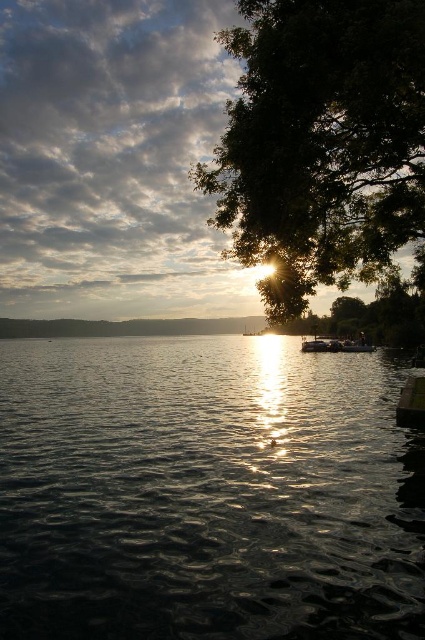
You are an observer standing at the lakeside. You see the glistening dark water at center and the green leafy tree at upper right. Which object is closer to you?

The glistening dark water at center is closer to you because it is in front of the green leafy tree at upper right.

You are an observer standing at the lakeside. You see the glistening dark water at center and the green leafy tree at upper right. Which object is positioned higher in the scene?

The green leafy tree at upper right is positioned higher in the scene than the glistening dark water at center, as it is located above it.

You are an observer standing at the lakeside. You see the glistening dark water at center and the green leafy tree at upper right. Which object appears closer to you in the image?

The glistening dark water at center appears closer to you because it is shorter than the green leafy tree at upper right, which is taller and positioned further away.